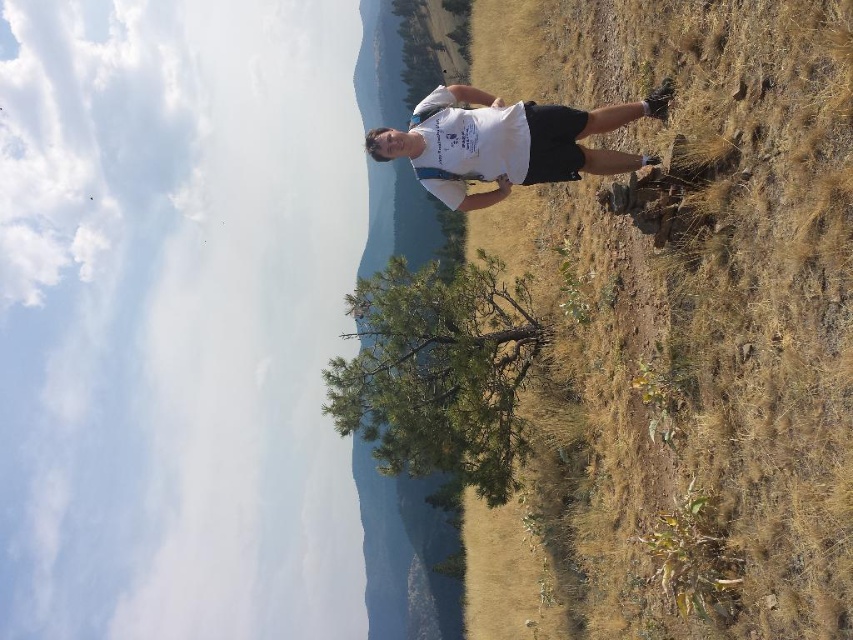
Question: Can you confirm if dry grass at right is smaller than white t-shirt at center?

Choices:
 (A) yes
 (B) no

Answer: (B)

Question: Observing the image, what is the correct spatial positioning of dry grass at right in reference to white t-shirt at center?

Choices:
 (A) left
 (B) right

Answer: (B)

Question: Which of the following is the closest to the observer?

Choices:
 (A) (804, 230)
 (B) (468, 157)

Answer: (A)

Question: Among these points, which one is farthest from the camera?

Choices:
 (A) (492, 132)
 (B) (814, 557)

Answer: (A)

Question: Where is dry grass at right located in relation to white t-shirt at center in the image?

Choices:
 (A) above
 (B) below

Answer: (A)